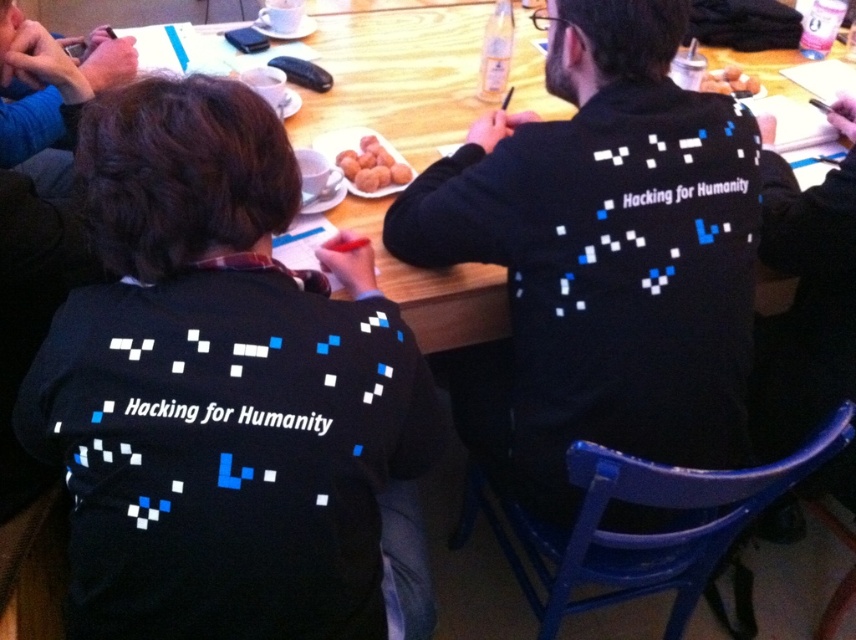
Question: Which of the following is the closest to the observer?

Choices:
 (A) (224, 298)
 (B) (342, 166)
 (C) (455, 252)
 (D) (710, 76)

Answer: (A)

Question: Is wooden table at center above brown matte balls at center?

Choices:
 (A) yes
 (B) no

Answer: (A)

Question: Which point is farther to the camera?

Choices:
 (A) (688, 456)
 (B) (391, 182)
 (C) (721, 92)
 (D) (489, 266)

Answer: (C)

Question: Which of these objects is positioned closest to the black matte shirt at center?

Choices:
 (A) brown crumbly doughnuts at center
 (B) black matte sweater at center
 (C) wooden table at center

Answer: (B)

Question: Is the position of black matte shirt at center more distant than that of black matte sweater at center?

Choices:
 (A) no
 (B) yes

Answer: (A)

Question: Can you confirm if wooden table at center is wider than brown crumbly doughnuts at center?

Choices:
 (A) yes
 (B) no

Answer: (A)